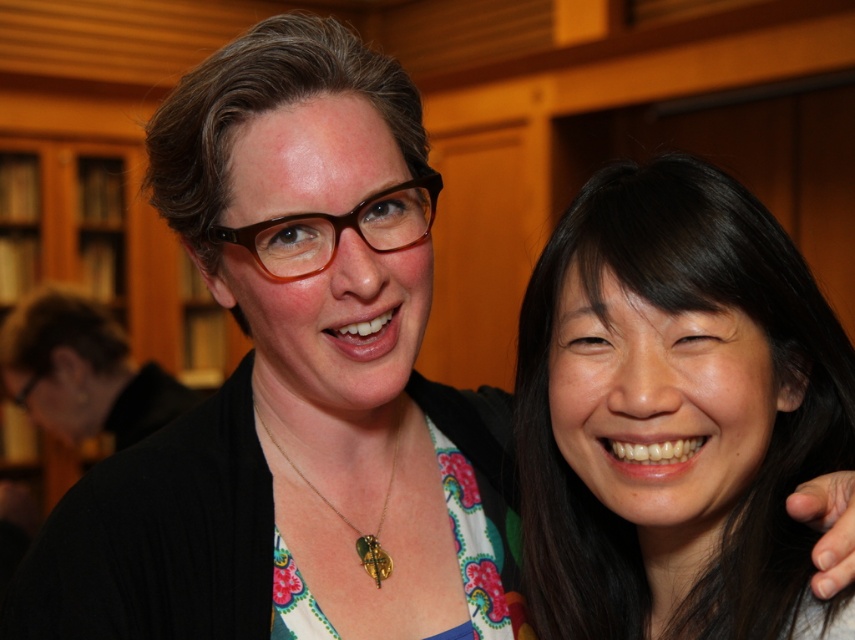
Can you confirm if black hair at right is wider than gold metallic pendant at center?

Indeed, black hair at right has a greater width compared to gold metallic pendant at center.

The height and width of the screenshot is (640, 855). Find the location of `black hair at right`. black hair at right is located at coordinates pos(675,413).